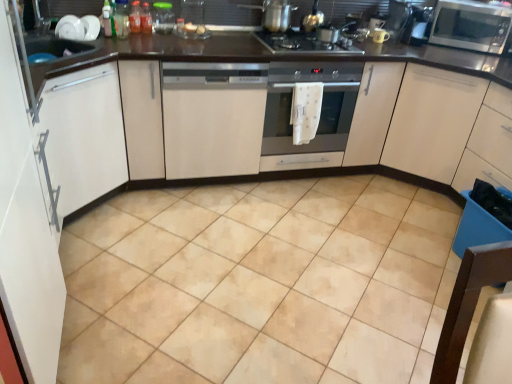
Question: Is black glass gas stove at center at the left side of translucent plastic bottle at upper center, which is the second bottle from left to right?

Choices:
 (A) no
 (B) yes

Answer: (A)

Question: From a real-world perspective, does black glass gas stove at center sit lower than translucent plastic bottle at upper center, which is the second bottle from left to right?

Choices:
 (A) no
 (B) yes

Answer: (B)

Question: Does black glass gas stove at center come behind translucent plastic bottle at upper center, acting as the second bottle starting from the right?

Choices:
 (A) yes
 (B) no

Answer: (B)

Question: Considering the relative sizes of black glass gas stove at center and translucent plastic bottle at upper center, which is the second bottle from left to right, in the image provided, is black glass gas stove at center wider than translucent plastic bottle at upper center, which is the second bottle from left to right,?

Choices:
 (A) yes
 (B) no

Answer: (A)

Question: Considering the relative positions of black glass gas stove at center and translucent plastic bottle at upper center, which is the second bottle from left to right, in the image provided, is black glass gas stove at center to the right of translucent plastic bottle at upper center, which is the second bottle from left to right, from the viewer's perspective?

Choices:
 (A) no
 (B) yes

Answer: (B)

Question: Visually, is white matte dishwasher at center, the third cabinetry in the left-to-right sequence, positioned to the left or to the right of translucent plastic bottle at upper center, arranged as the first bottle when viewed from the left?

Choices:
 (A) right
 (B) left

Answer: (A)

Question: Is point (258, 104) closer or farther from the camera than point (124, 21)?

Choices:
 (A) closer
 (B) farther

Answer: (B)

Question: Is white matte dishwasher at center, the third cabinetry in the left-to-right sequence, in front of or behind translucent plastic bottle at upper center, which is counted as the third bottle, starting from the right, in the image?

Choices:
 (A) behind
 (B) front

Answer: (B)

Question: From their relative heights in the image, would you say white matte dishwasher at center, the third cabinetry in the left-to-right sequence, is taller or shorter than translucent plastic bottle at upper center, which is counted as the third bottle, starting from the right?

Choices:
 (A) tall
 (B) short

Answer: (A)

Question: Is white matte cabinet at left, which is the 2th cabinetry from left to right, spatially inside satin silver microwave at upper right, or outside of it?

Choices:
 (A) outside
 (B) inside

Answer: (A)

Question: Looking at their shapes, would you say white matte cabinet at left, which ranks as the third cabinetry in right-to-left order, is wider or thinner than satin silver microwave at upper right?

Choices:
 (A) thin
 (B) wide

Answer: (A)

Question: Is point (2, 165) closer or farther from the camera than point (460, 46)?

Choices:
 (A) closer
 (B) farther

Answer: (A)

Question: Looking at the image, does white matte cabinet at left, which ranks as the third cabinetry in right-to-left order, seem bigger or smaller compared to satin silver microwave at upper right?

Choices:
 (A) big
 (B) small

Answer: (A)

Question: From their relative heights in the image, would you say satin silver microwave at upper right is taller or shorter than beige ceramic tile at center?

Choices:
 (A) short
 (B) tall

Answer: (B)

Question: Is satin silver microwave at upper right spatially inside beige ceramic tile at center, or outside of it?

Choices:
 (A) inside
 (B) outside

Answer: (B)